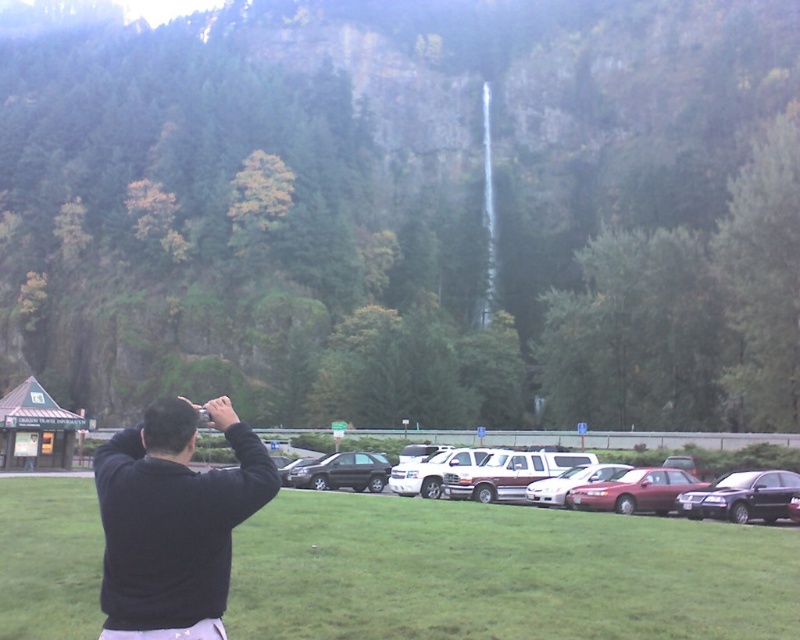
You are standing at the point marked as point (137,573) and want to walk towards the waterfall in the background. Is the point marked as point (637,496) located between you and the waterfall?

Yes, the point marked as point (637,496) is located between you and the waterfall because point (137,573) is closer to the camera than point (637,496).

You are a photographer positioned at the point marked by the coordinate point [713,458]. You want to capture the waterfall in the background. Is the metallic silver suv at center blocking your view of the waterfall?

The metallic silver suv at center is located at point [713,458], which is your current position. Since you are standing at the same coordinate as the metallic silver suv at center, it is likely blocking your view of the waterfall unless you move to a different location.

You are standing in the scenic outdoor setting with a black matte jacket at center and a metallic maroon sedan at center. Which object is nearer to you?

The black matte jacket at center is closer to the viewer than the metallic maroon sedan at center.